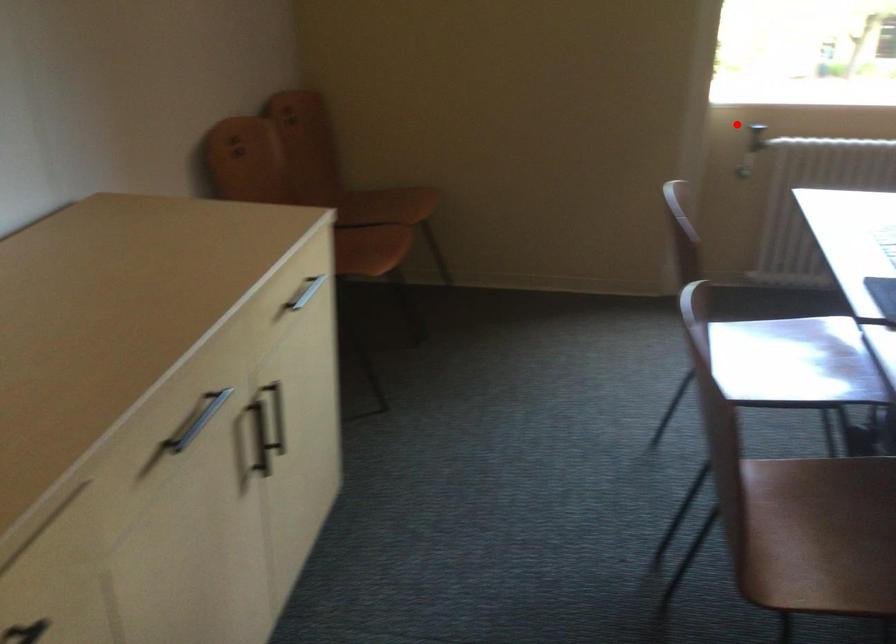
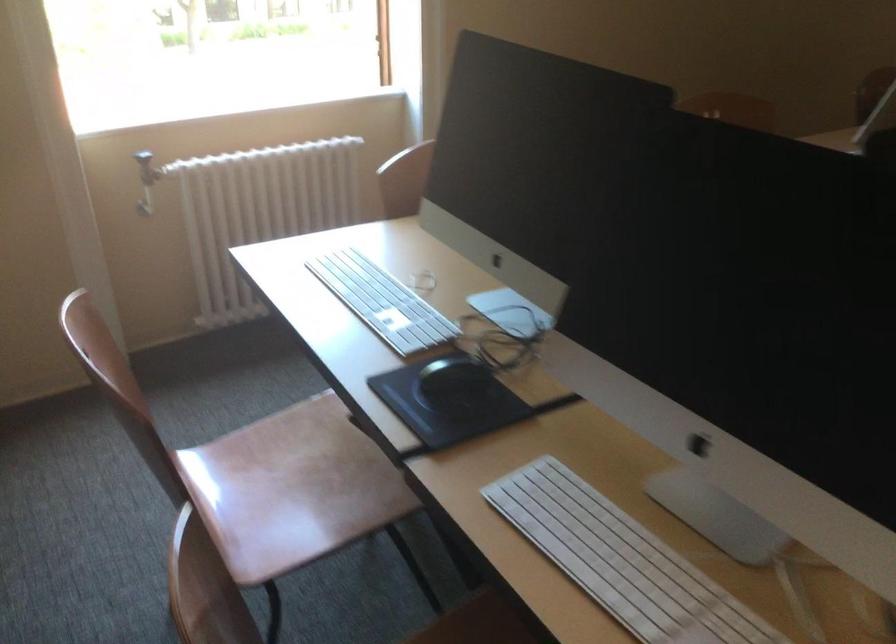
Question: I am providing you with two images of the same scene from different viewpoints. Given a red point in image1, look at the same physical point in image2. Is it:

Choices:
 (A) Closer to the viewpoint
 (B) Farther from the viewpoint

Answer: (A)